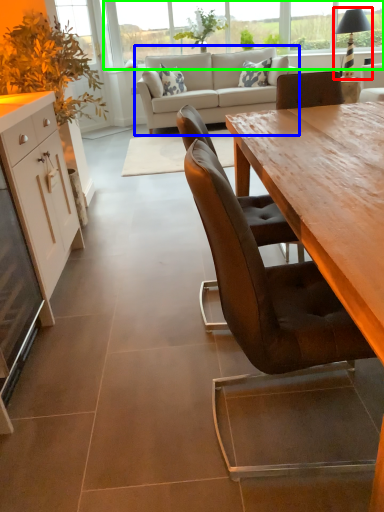
Question: Considering the real-world distances, which object is closest to lamp (highlighted by a red box)? studio couch (highlighted by a blue box) or window (highlighted by a green box).

Choices:
 (A) studio couch
 (B) window

Answer: (A)